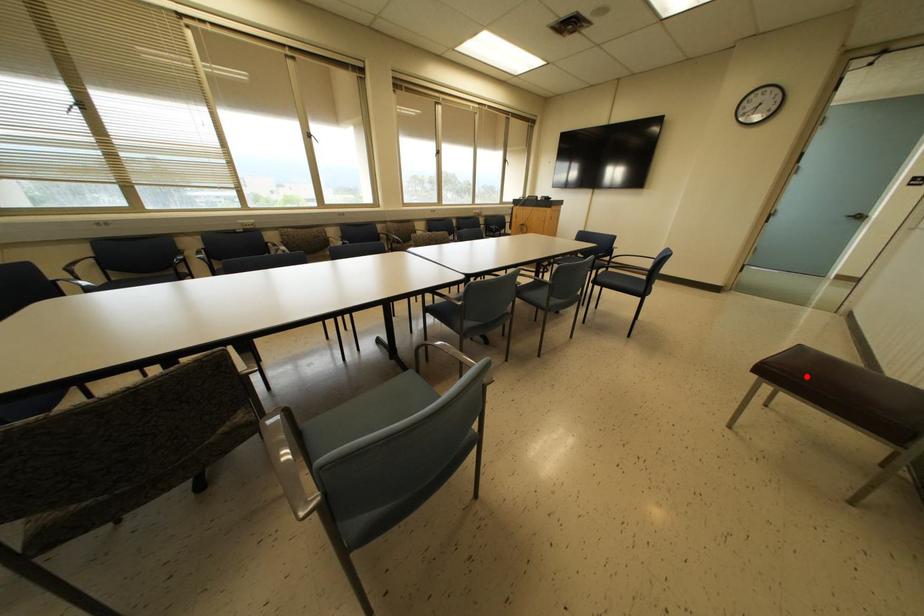
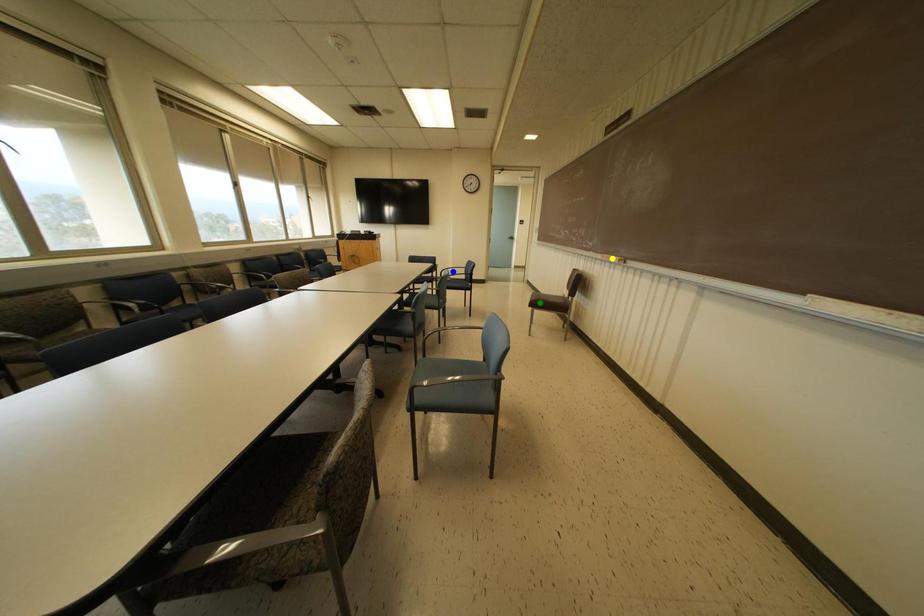
Question: I am providing you with two images of the same scene from different viewpoints. A red point is marked on the first image. You are given multiple points on the second image. Which spot in image 2 lines up with the point in image 1?

Choices:
 (A) green point
 (B) blue point
 (C) yellow point

Answer: (A)